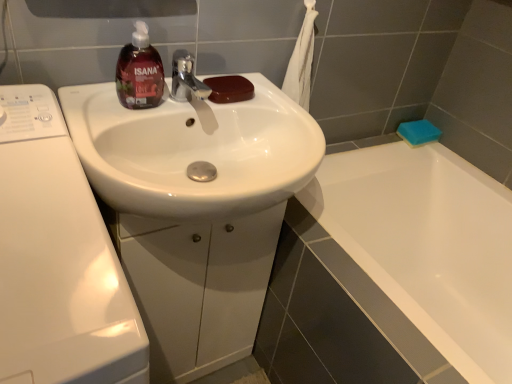
I want to click on vacant area that is in front of translucent dark red liquid soap at upper left, so click(108, 125).